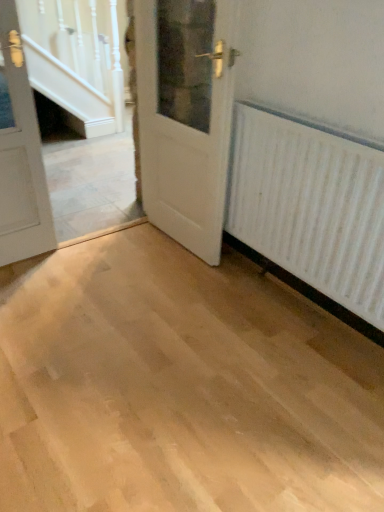
In order to click on vacant space underneath white wood door at center, placed as the 2th door when sorted from left to right (from a real-world perspective) in this screenshot , I will do `click(168, 245)`.